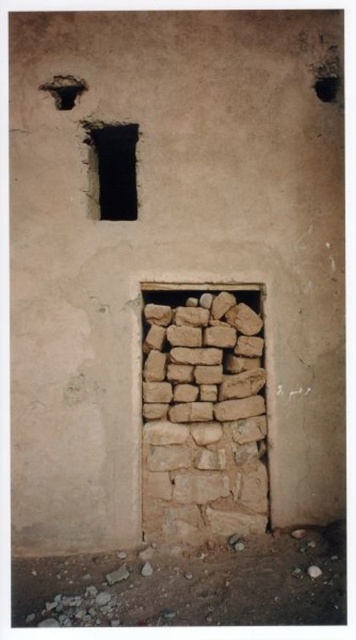
You are an architect examining this ancient wall. You notice the black stone window at upper center and the smooth dark hole at upper right. Which of these two features is positioned lower on the wall?

The black stone window at upper center is positioned lower on the wall than the smooth dark hole at upper right.

You are an architect examining an ancient wall. You notice two features on the wall. The first is the black stone window at upper center and the second is the smooth dark hole at upper right. Which of these two features is located to the left of the other?

The black stone window at upper center is positioned on the left side of smooth dark hole at upper right.